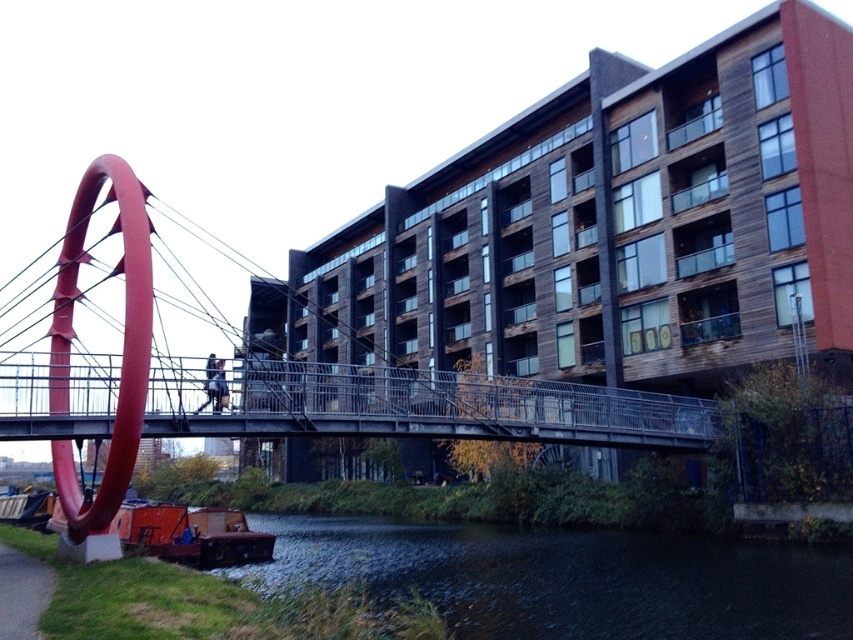
You are standing at the point marked by the coordinates point (573, 579). Looking around, you see dark water at lower left. What is the nearest object to you?

The nearest object to you is the dark water at lower left since you are standing at the point that marks its location.